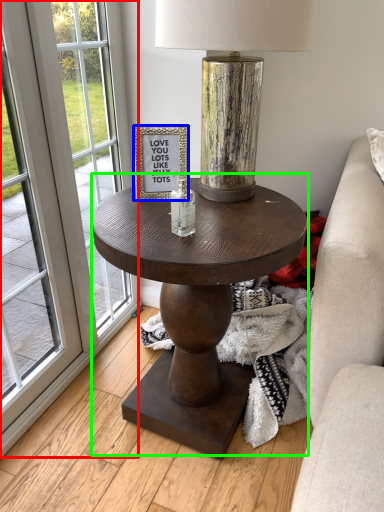
Question: Which is farther away from screen door (highlighted by a red box)? picture frame (highlighted by a blue box) or coffee table (highlighted by a green box)?

Choices:
 (A) picture frame
 (B) coffee table

Answer: (A)